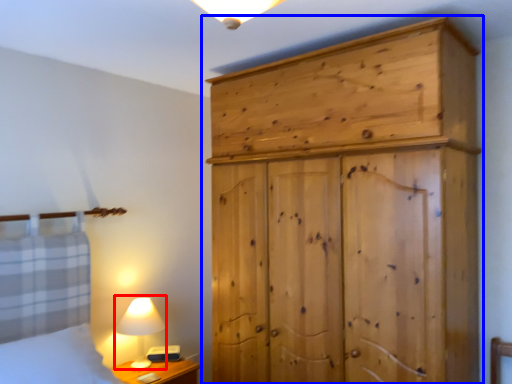
Question: Which point is further to the camera, table lamp (highlighted by a red box) or cupboard (highlighted by a blue box)?

Choices:
 (A) table lamp
 (B) cupboard

Answer: (A)